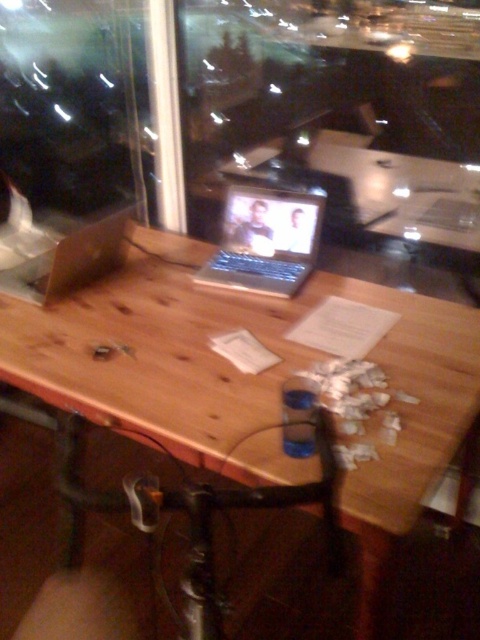
Question: Is wooden table at center to the left of silver metallic laptop at center from the viewer's perspective?

Choices:
 (A) no
 (B) yes

Answer: (B)

Question: Which point appears farthest from the camera in this image?

Choices:
 (A) (34, 278)
 (B) (171, 305)
 (C) (314, 220)

Answer: (C)

Question: Is silver metallic laptop at center positioned at the back of matte brown laptop at center?

Choices:
 (A) no
 (B) yes

Answer: (B)

Question: Estimate the real-world distances between objects in this image. Which object is farther from the matte brown laptop at center?

Choices:
 (A) wooden table at center
 (B) silver metallic laptop at center

Answer: (B)

Question: Which point is farther to the camera?

Choices:
 (A) silver metallic laptop at center
 (B) wooden table at center
 (C) matte brown laptop at center

Answer: (A)

Question: Can you confirm if wooden table at center is bigger than silver metallic laptop at center?

Choices:
 (A) no
 (B) yes

Answer: (B)